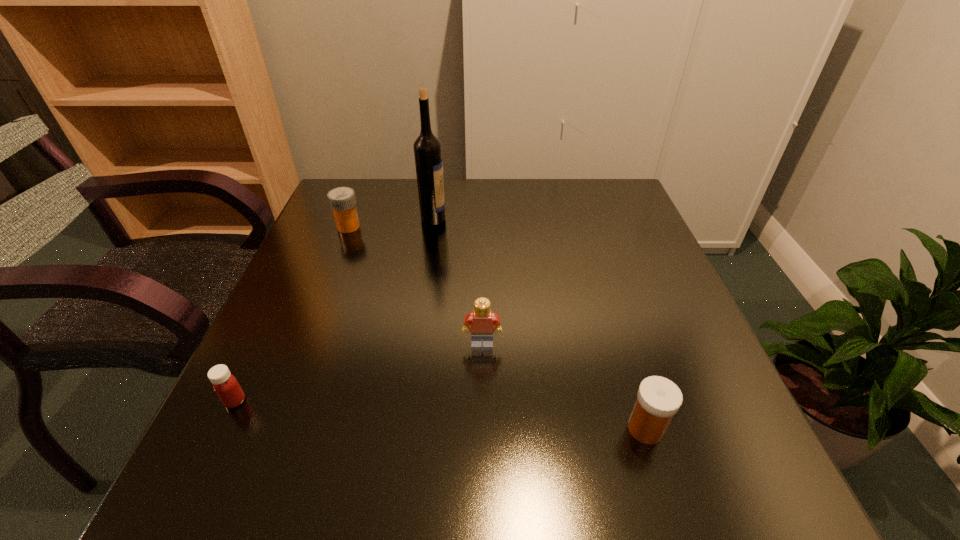
The height and width of the screenshot is (540, 960). In order to click on vacant position at the near edge of the desktop in this screenshot , I will do `click(398, 452)`.

Image resolution: width=960 pixels, height=540 pixels. Identify the location of vacant area at the left edge of the desktop. (293, 375).

In the image, there is a desktop. At what (x,y) coordinates should I click in order to perform the action: click on blank space at the right edge. Please return your answer as a coordinate pair (x, y). The height and width of the screenshot is (540, 960). Looking at the image, I should click on (660, 340).

Find the location of a particular element. This screenshot has width=960, height=540. vacant space at the far right corner of the desktop is located at coordinates (592, 217).

At what (x,y) coordinates should I click in order to perform the action: click on vacant area that lies between the second farthest medicine and the fourth object from right to left. Please return your answer as a coordinate pair (x, y). Looking at the image, I should click on (292, 314).

Identify the location of empty location between the leftmost medicine and the rightmost object. (441, 415).

In order to click on free point between the leftmost object and the fourth shortest object in this screenshot , I will do `click(359, 373)`.

Identify the location of free space between the second nearest medicine and the third nearest object. (359, 373).

I want to click on free space between the third nearest object and the third object from left to right, so click(458, 281).

Image resolution: width=960 pixels, height=540 pixels. Find the location of `vacant space that's between the tallest object and the farthest medicine`. vacant space that's between the tallest object and the farthest medicine is located at coordinates (391, 222).